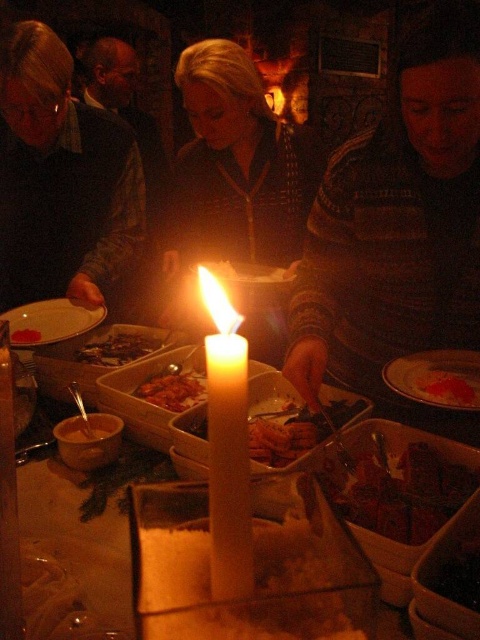
Does point (450, 404) come closer to viewer compared to point (93, 429)?

Yes.

Which is in front, point (469, 369) or point (108, 436)?

Point (108, 436) is more forward.

Image resolution: width=480 pixels, height=640 pixels. In order to click on white porcelain plate at center in this screenshot , I will do `click(436, 378)`.

Between point (137, 609) and point (35, 330), which one is positioned in front?

Point (137, 609) is more forward.

Is white wax candle at center smaller than smooth white cheese at center?

No, white wax candle at center is not smaller than smooth white cheese at center.

Between point (188, 621) and point (21, 340), which one is positioned in front?

Point (188, 621) is more forward.

Identify the location of white wax candle at center. (254, 570).

Looking at this image, is white matte candle at center behind matte white plate at lower left?

No.

Between white matte candle at center and matte white plate at lower left, which one has more height?

With more height is white matte candle at center.

Locate an element on the screen. white matte candle at center is located at coordinates (227, 445).

Where is `white matte candle at center`? white matte candle at center is located at coordinates (227, 445).